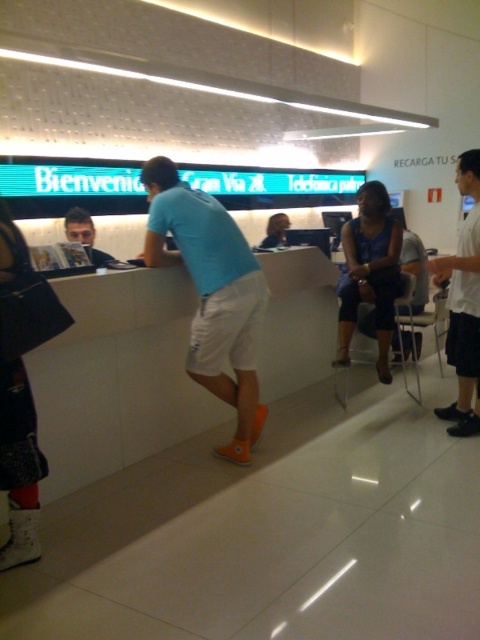
Question: Estimate the real-world distances between objects in this image. Which object is closer to the blue fabric dress at center?

Choices:
 (A) matte black book at left
 (B) white short pants at right

Answer: (B)

Question: Does light blue fabric shirt at center appear over white short pants at right?

Choices:
 (A) no
 (B) yes

Answer: (A)

Question: Which of these objects is positioned closest to the light blue fabric shirt at center?

Choices:
 (A) white short pants at right
 (B) matte black book at left

Answer: (B)

Question: Is white short pants at right in front of matte black book at left?

Choices:
 (A) no
 (B) yes

Answer: (A)

Question: In this image, where is light blue fabric shirt at center located relative to matte black book at left?

Choices:
 (A) above
 (B) below

Answer: (B)

Question: Which point is farther to the camera?

Choices:
 (A) light blue fabric shirt at center
 (B) blue fabric dress at center
 (C) matte black book at left
 (D) white short pants at right

Answer: (B)